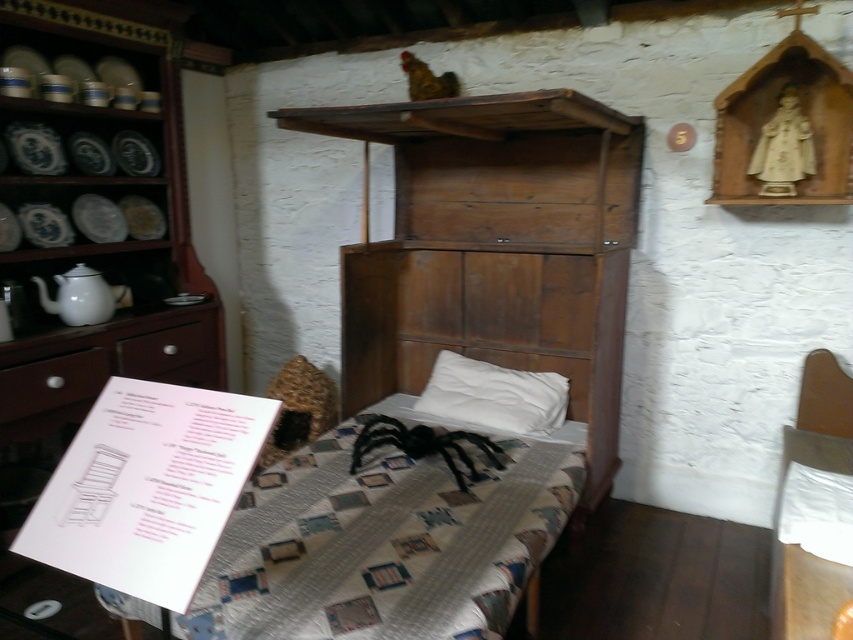
Question: Among these objects, which one is farthest from the camera?

Choices:
 (A) matte brown drawer at left
 (B) white soft pillow at center
 (C) wooden bed frame at center

Answer: (A)

Question: In this image, where is wooden chair at right located relative to matte brown drawer at left?

Choices:
 (A) above
 (B) below

Answer: (B)

Question: Which object is closer to the camera taking this photo?

Choices:
 (A) matte white drawer at lower left
 (B) white soft pillow at center
 (C) matte brown drawer at left

Answer: (A)

Question: Is quilted fabric quilt at center wider than matte white drawer at lower left?

Choices:
 (A) no
 (B) yes

Answer: (B)

Question: Which point is farther to the camera?

Choices:
 (A) white soft pillow at center
 (B) matte brown drawer at left
 (C) matte white drawer at lower left

Answer: (B)

Question: Is wooden bed frame at center to the right of matte white drawer at lower left from the viewer's perspective?

Choices:
 (A) no
 (B) yes

Answer: (B)